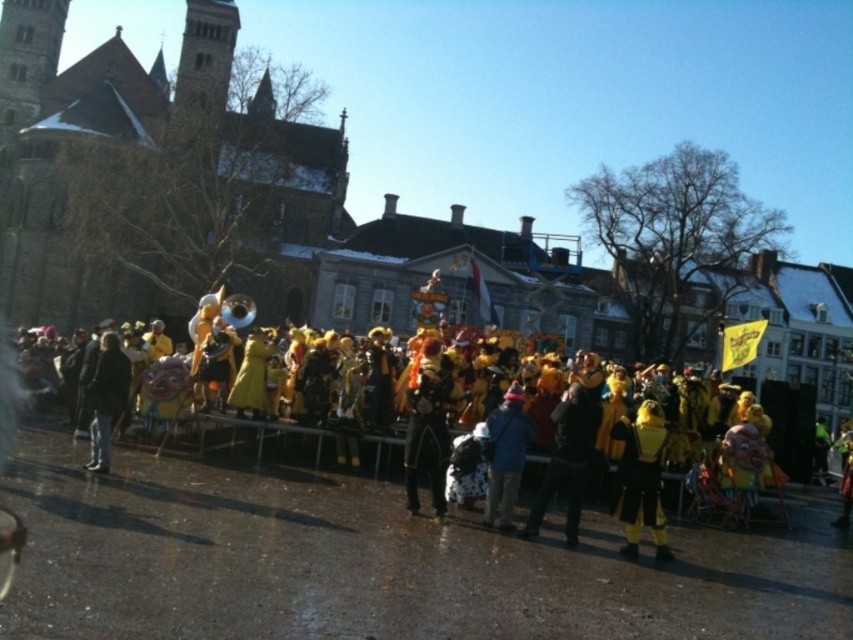
Question: Does black velvet costume at center come in front of dark gray jacket at center?

Choices:
 (A) yes
 (B) no

Answer: (A)

Question: Which object appears closest to the camera in this image?

Choices:
 (A) black velvet costume at center
 (B) blue fabric jacket at center

Answer: (A)

Question: Is orange velvet costume at center to the left of dark gray jacket at center from the viewer's perspective?

Choices:
 (A) yes
 (B) no

Answer: (B)

Question: Which of the following is the closest to the observer?

Choices:
 (A) (122, 353)
 (B) (637, 481)
 (C) (514, 381)
 (D) (426, 369)

Answer: (B)

Question: Observing the image, what is the correct spatial positioning of black velvet costume at center in reference to dark gray jacket at center?

Choices:
 (A) right
 (B) left

Answer: (A)

Question: Which of these objects is positioned farthest from the orange velvet costume at center?

Choices:
 (A) dark gray jacket at center
 (B) black matte jacket at center
 (C) black velvet costume at center

Answer: (A)